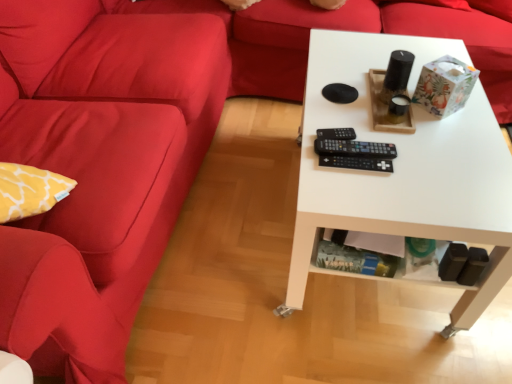
Locate an element on the screen. The image size is (512, 384). vacant space behind black plastic remote at center, acting as the 1th control starting from the top is located at coordinates (336, 102).